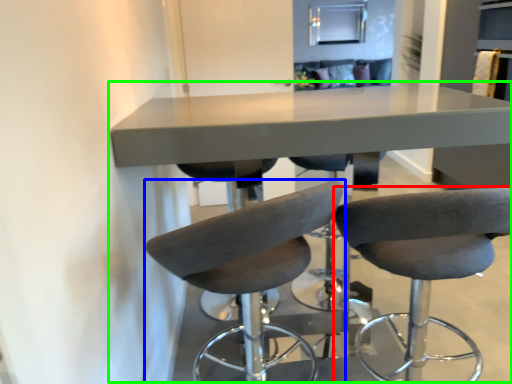
Question: Estimate the real-world distances between objects in this image. Which object is farther from chair (highlighted by a red box), chair (highlighted by a blue box) or table (highlighted by a green box)?

Choices:
 (A) chair
 (B) table

Answer: (B)